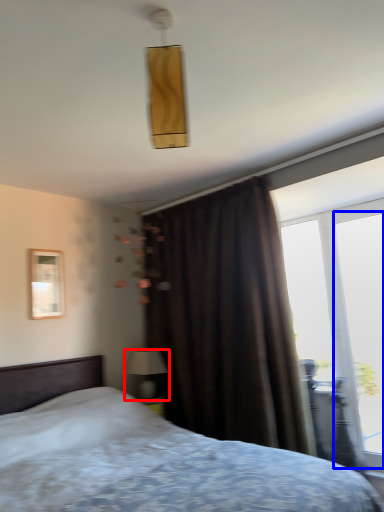
Question: Which point is closer to the camera, table lamp (highlighted by a red box) or window (highlighted by a blue box)?

Choices:
 (A) table lamp
 (B) window

Answer: (B)